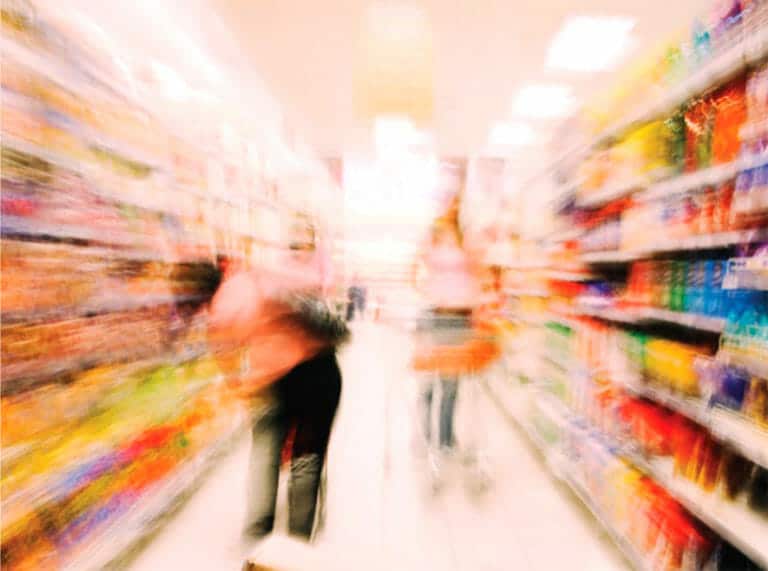
At what (x,y) coordinates should I click in order to perform the action: click on ceiling. Please return your answer as a coordinate pair (x, y). The height and width of the screenshot is (571, 768). Looking at the image, I should click on (485, 75), (305, 86).